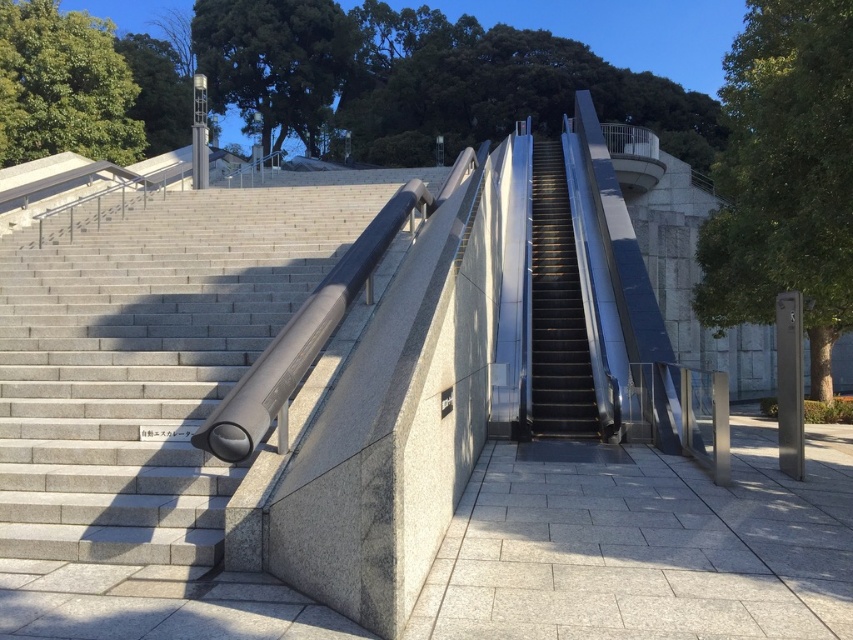
Based on the photo, is gray concrete stairs at left positioned before black metal escalator at center?

Yes.

Who is more distant from viewer, (x=99, y=561) or (x=532, y=404)?

The point (x=532, y=404) is behind.

Describe the element at coordinates (146, 364) in the screenshot. I see `gray concrete stairs at left` at that location.

The width and height of the screenshot is (853, 640). Identify the location of gray concrete stairs at left. (146, 364).